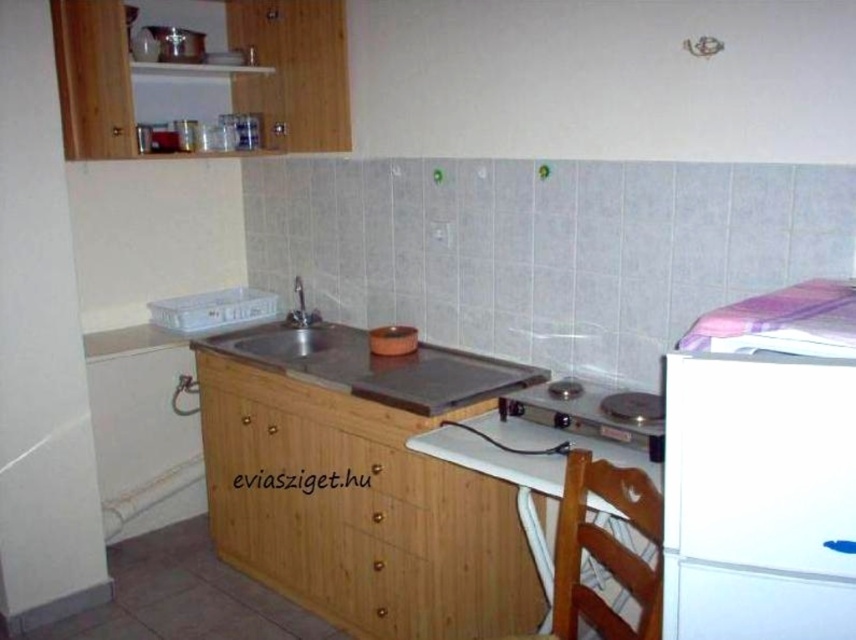
You are trying to place a new appliance in this kitchenette. The metallic gray stove at center needs to be moved closer to the white matte refrigerator at right. Is there enough vertical space between them to allow this adjustment?

The white matte refrigerator at right is located above the metallic gray stove at center, so moving the stove closer vertically may not be possible due to the refrigerator being positioned higher up. Check the available space below the refrigerator or beside the stove for alternative placement options.

You are a chef preparing a meal and need to place a large cutting board on the countertop. The board is wider than the metallic gray stove at center. Can you fit it on the space where the metallic sink at center is located?

The metallic sink at center is wider than the metallic gray stove at center. Since the cutting board is wider than the stove, it might still fit on the sink area if the sink itself is wide enough. However, the sink is an active area for water use, so placing a cutting board there could be impractical. Consider using a different area of the countertop instead.

You are standing in the kitchenette and need to place a new appliance. The point you are looking at is at coordinate point (758, 497). What appliance is located at this coordinate?

The white matte refrigerator at right is located at point (758, 497).